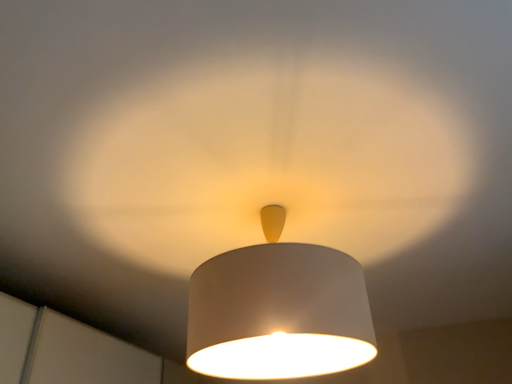
Question: Is the position of matte white lampshade at center less distant than that of white matte lampshade at center?

Choices:
 (A) yes
 (B) no

Answer: (A)

Question: Is matte white lampshade at center far from white matte lampshade at center?

Choices:
 (A) yes
 (B) no

Answer: (B)

Question: Does matte white lampshade at center have a greater width compared to white matte lampshade at center?

Choices:
 (A) no
 (B) yes

Answer: (B)

Question: Can you confirm if matte white lampshade at center is thinner than white matte lampshade at center?

Choices:
 (A) no
 (B) yes

Answer: (A)

Question: Is matte white lampshade at center positioned behind white matte lampshade at center?

Choices:
 (A) no
 (B) yes

Answer: (A)

Question: Is matte white lampshade at center taller than white matte lampshade at center?

Choices:
 (A) yes
 (B) no

Answer: (B)

Question: Considering the relative sizes of white matte lampshade at center and matte white lampshade at center in the image provided, is white matte lampshade at center taller than matte white lampshade at center?

Choices:
 (A) no
 (B) yes

Answer: (B)

Question: Is white matte lampshade at center wider than matte white lampshade at center?

Choices:
 (A) no
 (B) yes

Answer: (A)

Question: Is matte white lampshade at center inside white matte lampshade at center?

Choices:
 (A) yes
 (B) no

Answer: (B)

Question: Can we say white matte lampshade at center lies outside matte white lampshade at center?

Choices:
 (A) no
 (B) yes

Answer: (B)

Question: Is white matte lampshade at center positioned with its back to matte white lampshade at center?

Choices:
 (A) no
 (B) yes

Answer: (A)

Question: Is white matte lampshade at center in contact with matte white lampshade at center?

Choices:
 (A) yes
 (B) no

Answer: (B)

Question: Relative to matte white lampshade at center, is white matte lampshade at center in front or behind?

Choices:
 (A) behind
 (B) front

Answer: (A)